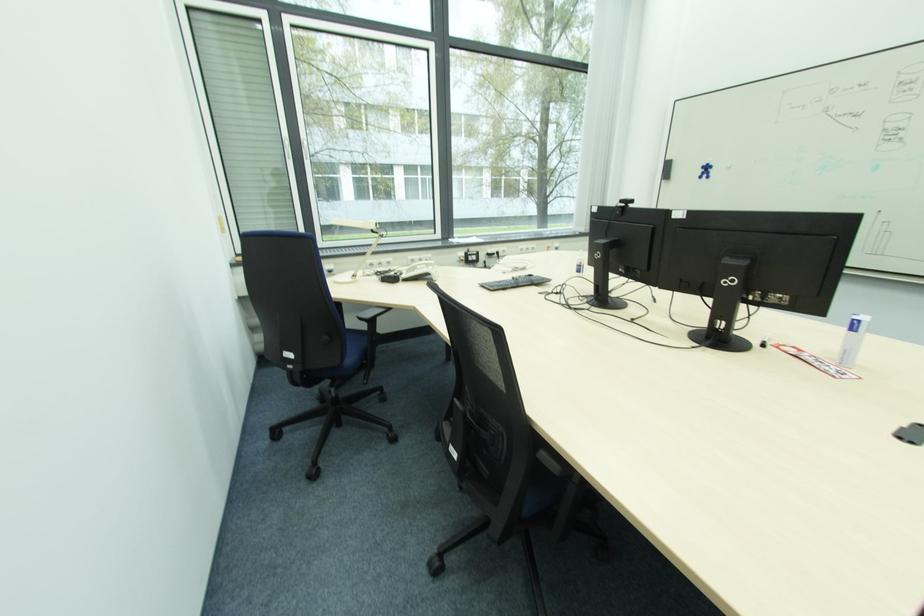
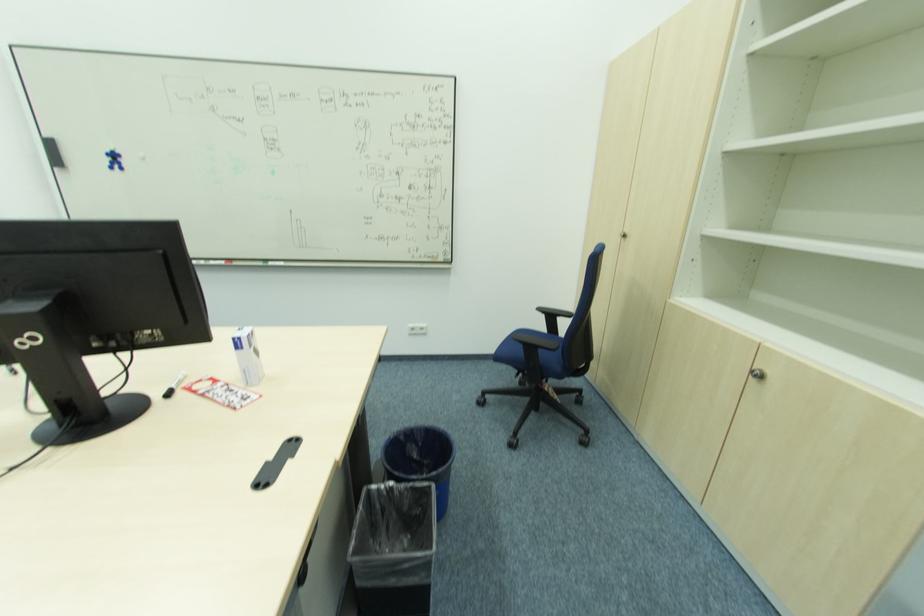
Where in the second image is the point corresponding to point (865, 323) from the first image?

(244, 339)